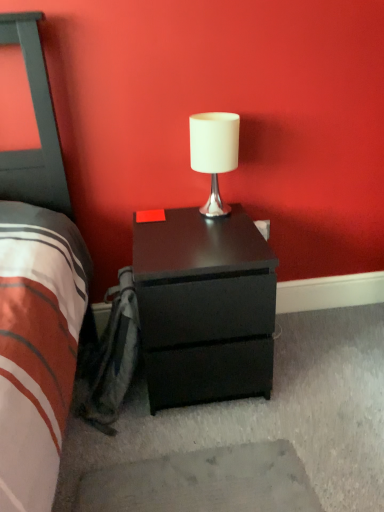
At what (x,y) coordinates should I click in order to perform the action: click on vacant space underneath white matte table lamp at center (from a real-world perspective). Please return your answer as a coordinate pair (x, y). This screenshot has height=512, width=384. Looking at the image, I should click on (219, 212).